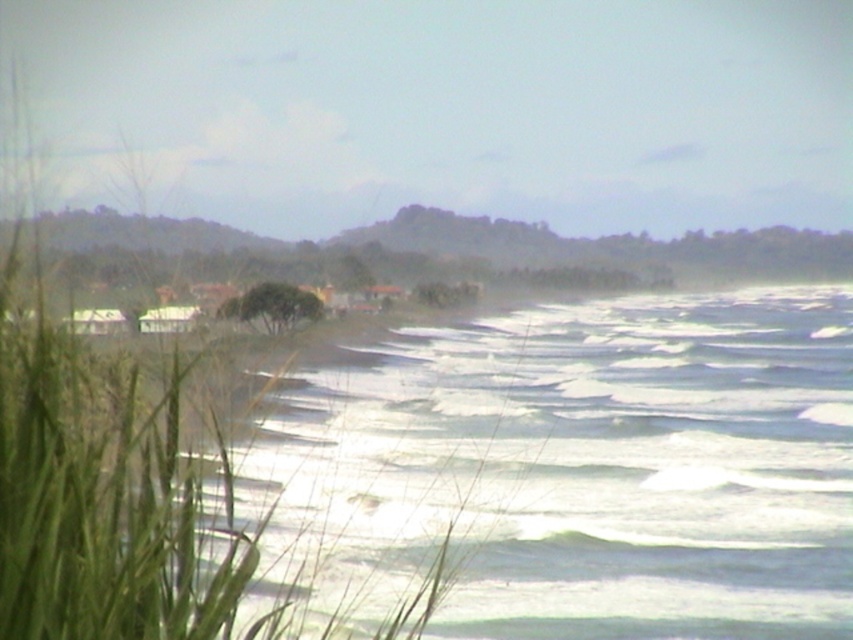
Between green grass at left and green leafy tree at center, which one is positioned higher?

Positioned higher is green leafy tree at center.

Which is in front, point (47, 397) or point (279, 300)?

Point (47, 397) is in front.

Where is `green grass at left`? This screenshot has height=640, width=853. green grass at left is located at coordinates (103, 490).

Identify the location of green grass at left. (103, 490).